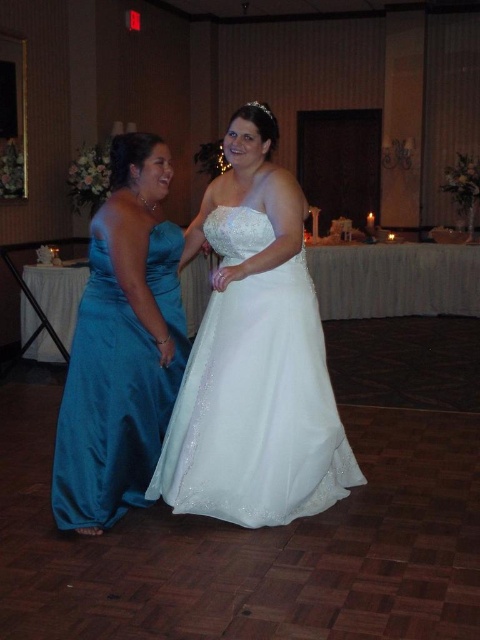
You are standing at the entrance of the wedding reception and see two points marked in the image. Which point is closer to you, point (197, 410) or point (100, 401)?

Point (197, 410) is closer to you because it is further to the viewer than point (100, 401).

You are a photographer at a wedding reception. You need to position yourself so that both the white satin dress at center and the teal satin dress at left are in your frame. Based on their positions, which direction should you face to ensure both are visible?

You should face towards the right side of the teal satin dress at left to include both the white satin dress at center and the teal satin dress at left in your frame, since the white satin dress at center is positioned to the right of the teal satin dress at left.